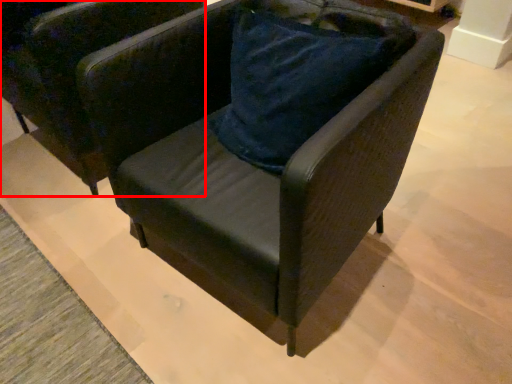
Question: Where is chair (annotated by the red box) located in relation to chair in the image?

Choices:
 (A) left
 (B) right

Answer: (A)